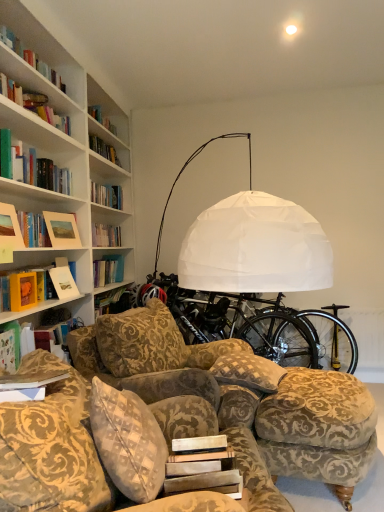
Question: Is black metallic bicycle wheel at lower right taller than black matte bicycle at center?

Choices:
 (A) no
 (B) yes

Answer: (A)

Question: Is black metallic bicycle wheel at lower right at the right side of black matte bicycle at center?

Choices:
 (A) yes
 (B) no

Answer: (A)

Question: Is black metallic bicycle wheel at lower right smaller than black matte bicycle at center?

Choices:
 (A) no
 (B) yes

Answer: (B)

Question: From the image's perspective, is black metallic bicycle wheel at lower right above black matte bicycle at center?

Choices:
 (A) no
 (B) yes

Answer: (A)

Question: From the image's perspective, is black metallic bicycle wheel at lower right under black matte bicycle at center?

Choices:
 (A) no
 (B) yes

Answer: (B)

Question: Is white paper at center, which is the first paperback book in front-to-back order, taller or shorter than velvet-patterned couch at lower center?

Choices:
 (A) tall
 (B) short

Answer: (B)

Question: From a real-world perspective, is white paper at center, the 2th paperback book viewed from the back, above or below velvet-patterned couch at lower center?

Choices:
 (A) above
 (B) below

Answer: (A)

Question: Considering their positions, is white paper at center, the second paperback book viewed from the left, located in front of or behind velvet-patterned couch at lower center?

Choices:
 (A) front
 (B) behind

Answer: (B)

Question: Considering the positions of white paper at center, acting as the first paperback book starting from the bottom, and velvet-patterned couch at lower center in the image, is white paper at center, acting as the first paperback book starting from the bottom, bigger or smaller than velvet-patterned couch at lower center?

Choices:
 (A) big
 (B) small

Answer: (B)

Question: Is gold-patterned fabric ottoman at lower right in front of or behind black matte bicycle wheel at center in the image?

Choices:
 (A) behind
 (B) front

Answer: (B)

Question: Is gold-patterned fabric ottoman at lower right bigger or smaller than black matte bicycle wheel at center?

Choices:
 (A) small
 (B) big

Answer: (B)

Question: Looking at their shapes, would you say gold-patterned fabric ottoman at lower right is wider or thinner than black matte bicycle wheel at center?

Choices:
 (A) wide
 (B) thin

Answer: (A)

Question: Is gold-patterned fabric ottoman at lower right situated inside black matte bicycle wheel at center or outside?

Choices:
 (A) inside
 (B) outside

Answer: (B)

Question: Looking at their shapes, would you say velvet-patterned couch at lower center is wider or thinner than white paper at center, the 2th paperback book from the top?

Choices:
 (A) wide
 (B) thin

Answer: (A)

Question: Is velvet-patterned couch at lower center in front of or behind white paper at center, the second paperback book viewed from the left, in the image?

Choices:
 (A) behind
 (B) front

Answer: (B)